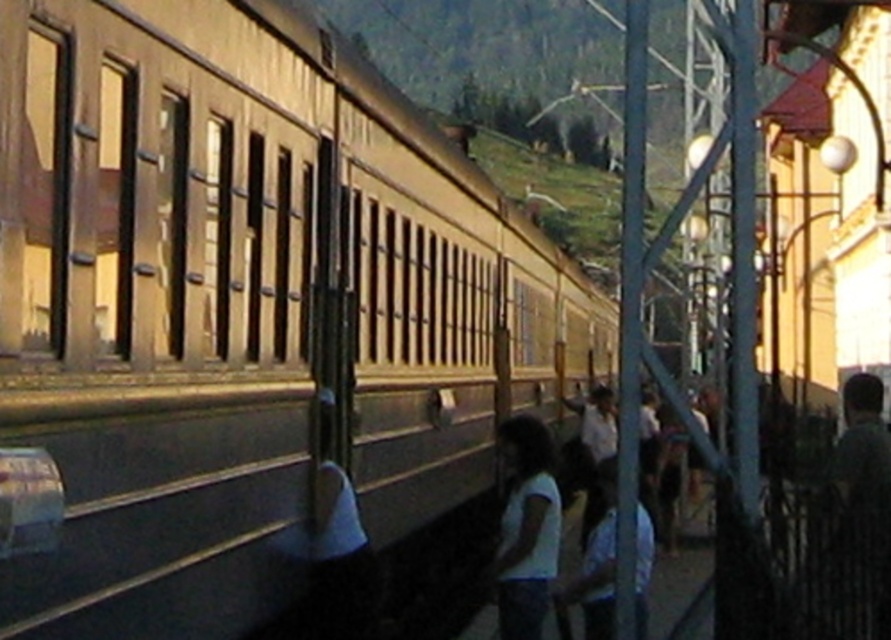
Does metallic gold train at center have a lesser height compared to white matte shirt at lower center?

No.

Is metallic gold train at center further to camera compared to white matte shirt at lower center?

No, metallic gold train at center is closer to the viewer.

Which is in front, point (83, 320) or point (521, 486)?

Positioned in front is point (83, 320).

At what (x,y) coordinates should I click in order to perform the action: click on metallic gold train at center. Please return your answer as a coordinate pair (x, y). Image resolution: width=891 pixels, height=640 pixels. Looking at the image, I should click on (240, 301).

Does point (505, 508) come in front of point (861, 531)?

No, it is behind (861, 531).

Is white matte shirt at lower center shorter than dark green shirt at right?

In fact, white matte shirt at lower center may be taller than dark green shirt at right.

Does point (530, 630) lie in front of point (873, 477)?

Yes, point (530, 630) is in front of point (873, 477).

Find the location of a particular element. white matte shirt at lower center is located at coordinates (525, 529).

Image resolution: width=891 pixels, height=640 pixels. Identify the location of white fabric at center. (336, 534).

Is white fabric at center bigger than dark green shirt at right?

Result: Yes.

I want to click on white fabric at center, so click(336, 534).

Locate an element on the screen. The height and width of the screenshot is (640, 891). white fabric at center is located at coordinates (336, 534).